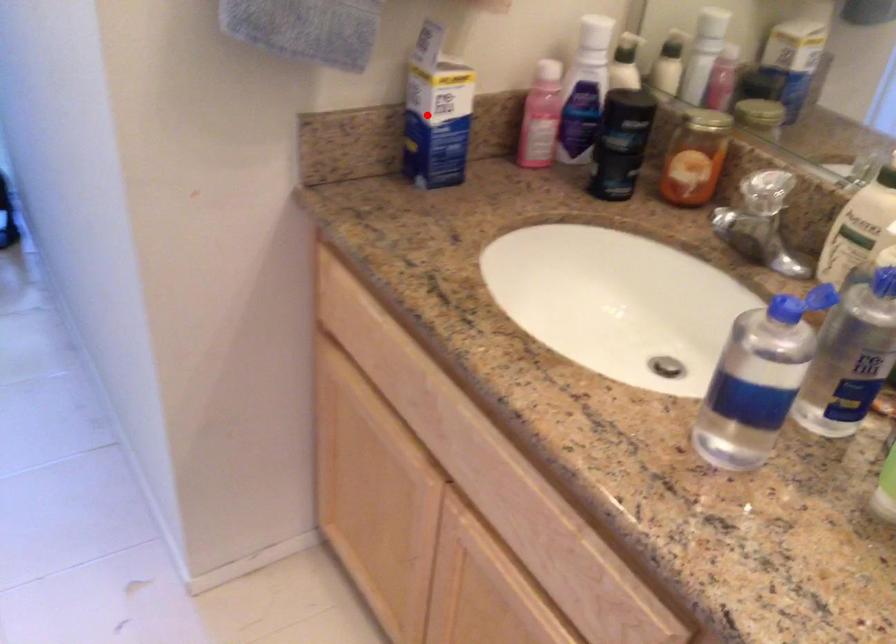
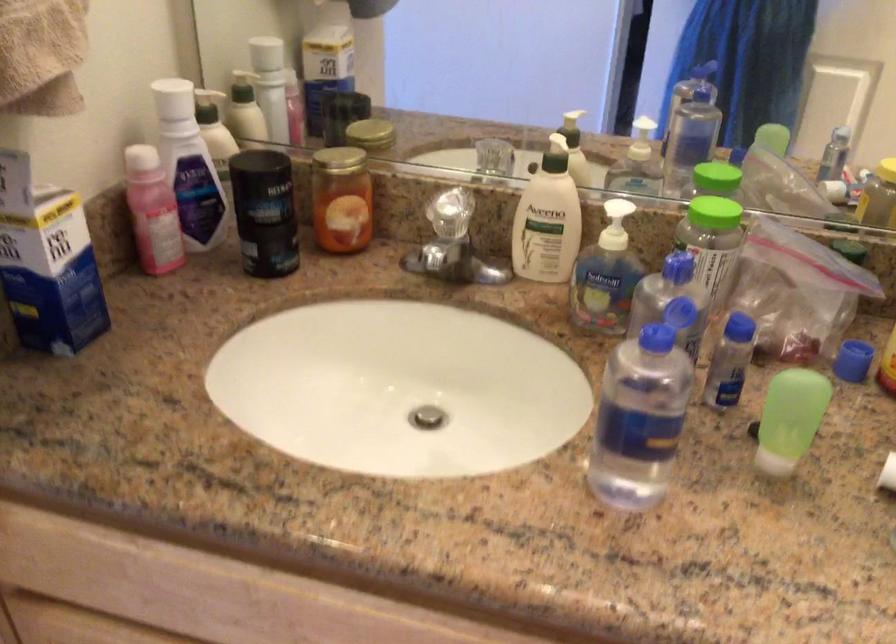
Question: A red point is marked in image1. In image2, is the corresponding 3D point closer to the camera or farther? Reply with the corresponding letter.

Choices:
 (A) The corresponding 3D point is closer.
 (B) The corresponding 3D point is farther.

Answer: (A)